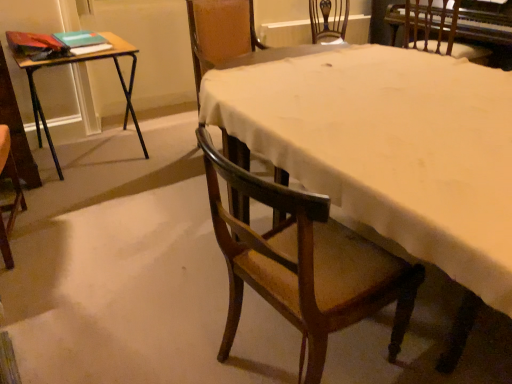
In order to click on free location to the left of wooden chair at center, the 2th chair when ordered from back to front in this screenshot , I will do `click(163, 168)`.